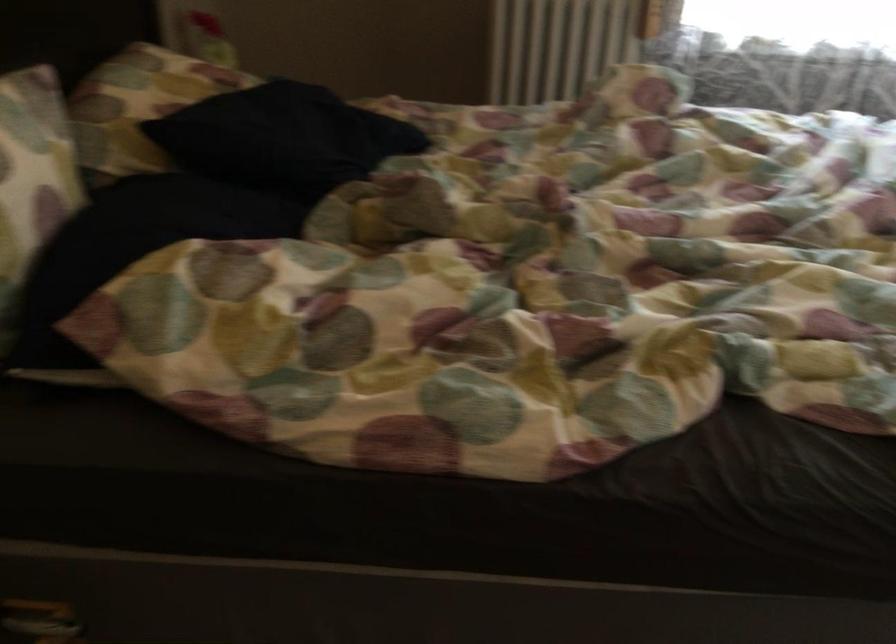
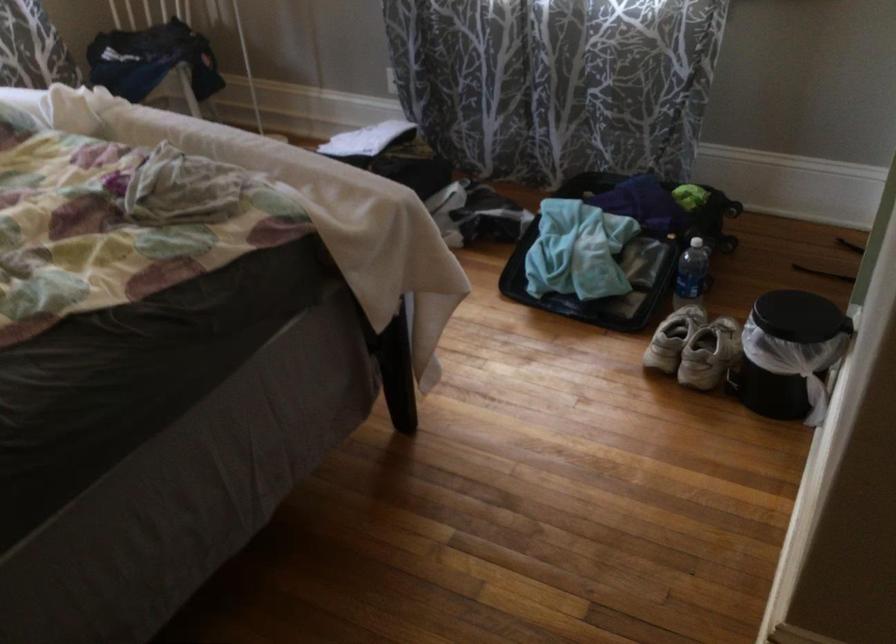
Based on the continuous images, in which direction is the camera rotating?

The camera rotated toward right-down.